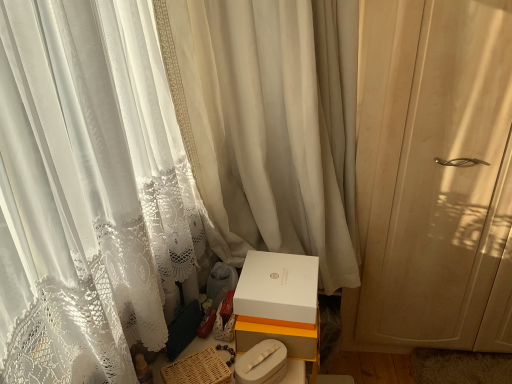
Question: In the image, is woven brown basket at lower center positioned in front of or behind white lace curtain at right, arranged as the 1th curtain when viewed from the right?

Choices:
 (A) front
 (B) behind

Answer: (A)

Question: From the image's perspective, is woven brown basket at lower center positioned above or below white lace curtain at right, arranged as the 1th curtain when viewed from the right?

Choices:
 (A) above
 (B) below

Answer: (B)

Question: Which is farther from the white matte box at center, the second box in the top-to-bottom sequence?

Choices:
 (A) white sheer curtain at center, positioned as the 2th curtain in right-to-left order
 (B) white matte box at lower center, the second box when ordered from bottom to top
 (C) white lace curtain at right, which ranks as the 2th curtain in left-to-right order
 (D) woven brown basket at lower center

Answer: (C)

Question: Estimate the real-world distances between objects in this image. Which object is farther from the white sheer curtain at center, which appears as the first curtain when viewed from the left?

Choices:
 (A) white lace curtain at right, arranged as the 1th curtain when viewed from the right
 (B) white matte box at center, the second box in the top-to-bottom sequence
 (C) woven brown basket at lower center
 (D) white matte box at lower center, the first box in the top-to-bottom sequence

Answer: (C)